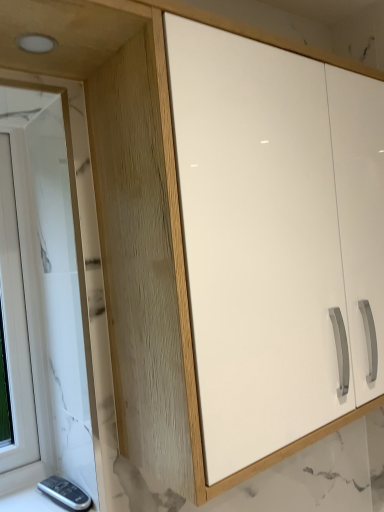
Question: Is point (26, 182) positioned closer to the camera than point (244, 223)?

Choices:
 (A) closer
 (B) farther

Answer: (B)

Question: In terms of height, does white marble window at left look taller or shorter compared to white glossy cabinet at center?

Choices:
 (A) short
 (B) tall

Answer: (B)

Question: Choose the correct answer: Is white marble window at left inside white glossy cabinet at center or outside it?

Choices:
 (A) outside
 (B) inside

Answer: (A)

Question: Is point (316, 375) closer or farther from the camera than point (31, 222)?

Choices:
 (A) closer
 (B) farther

Answer: (A)

Question: Is white glossy cabinet at center to the left or to the right of white marble window at left in the image?

Choices:
 (A) right
 (B) left

Answer: (A)

Question: From a real-world perspective, is white glossy cabinet at center above or below white marble window at left?

Choices:
 (A) below
 (B) above

Answer: (B)

Question: From the image's perspective, is white glossy cabinet at center above or below white marble window at left?

Choices:
 (A) below
 (B) above

Answer: (B)